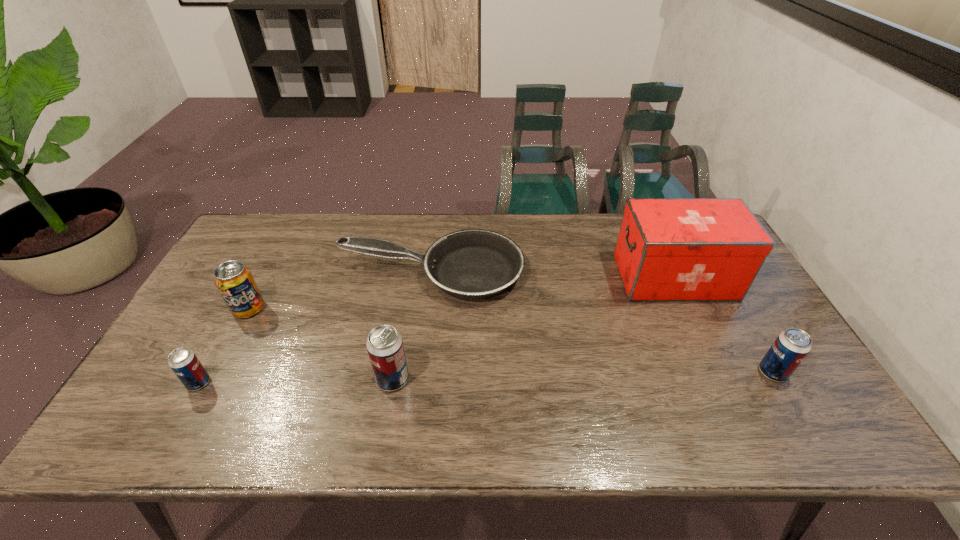
Identify the location of free space between the rightmost beer can and the second beer can from right to left. This screenshot has width=960, height=540. (583, 376).

Where is `vacant space that is in between the leftmost beer can and the first-aid kit`? vacant space that is in between the leftmost beer can and the first-aid kit is located at coordinates (437, 330).

The height and width of the screenshot is (540, 960). Find the location of `vacant space that is in between the soda can and the second shortest object`. vacant space that is in between the soda can and the second shortest object is located at coordinates (224, 346).

Where is `vacant space that's between the rightmost beer can and the soda can`? The height and width of the screenshot is (540, 960). vacant space that's between the rightmost beer can and the soda can is located at coordinates click(x=511, y=341).

The image size is (960, 540). In order to click on empty location between the tallest object and the leftmost beer can in this screenshot , I will do `click(437, 330)`.

This screenshot has width=960, height=540. Identify the location of empty location between the leftmost beer can and the tallest beer can. (296, 381).

Locate an element on the screen. free space between the frying pan and the first-aid kit is located at coordinates (552, 275).

The image size is (960, 540). Identify the location of object that is the second nearest to the second tallest beer can. (473, 263).

Select which object is the third closest to the shortest beer can. Please provide its 2D coordinates. Your answer should be formatted as a tuple, i.e. [(x, y)], where the tuple contains the x and y coordinates of a point satisfying the conditions above.

[(385, 348)]

Identify the location of beer can that stands as the second closest to the rightmost beer can. The image size is (960, 540). tap(184, 363).